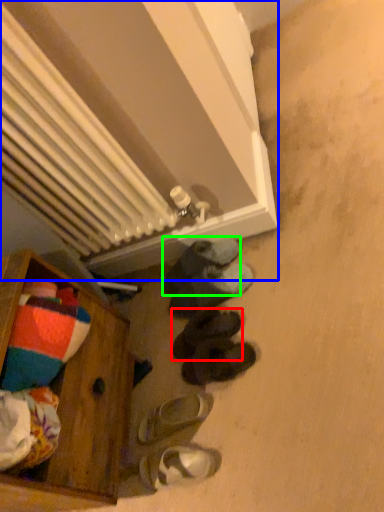
Question: Which is farther away from footwear (highlighted by a red box)? radiator (highlighted by a blue box) or footwear (highlighted by a green box)?

Choices:
 (A) radiator
 (B) footwear

Answer: (A)